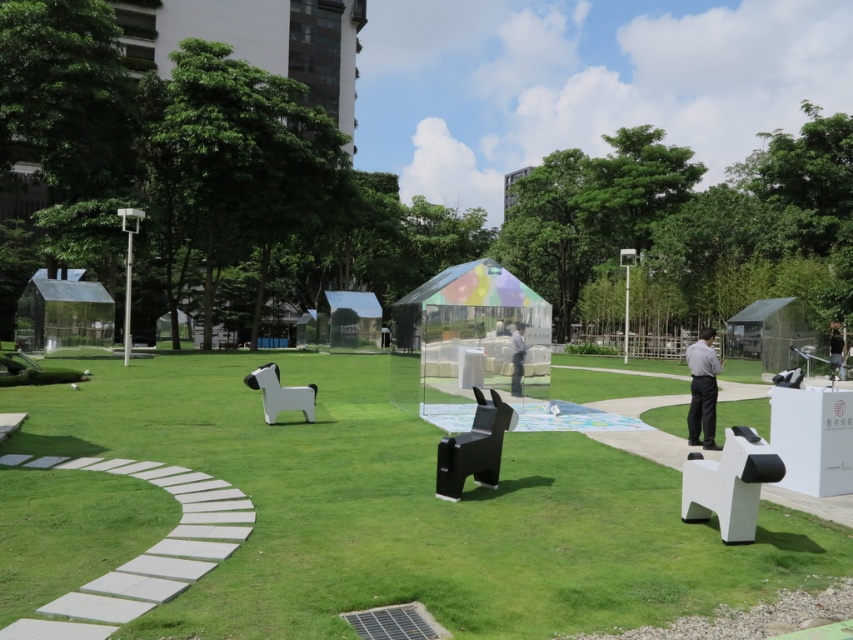
Question: Is white matte dog at center wider than light gray fabric shirt at right?

Choices:
 (A) no
 (B) yes

Answer: (B)

Question: Can you confirm if white matte dog at center is positioned to the left of smooth gray shirt at right?

Choices:
 (A) no
 (B) yes

Answer: (B)

Question: Which object appears farthest from the camera in this image?

Choices:
 (A) white matte dog at center
 (B) smooth gray shirt at right
 (C) gray fabric person at center
 (D) light gray fabric shirt at right

Answer: (B)

Question: Observing the image, what is the correct spatial positioning of black plastic dog at center in reference to gray fabric person at center?

Choices:
 (A) left
 (B) right

Answer: (A)

Question: Which point is closer to the camera?

Choices:
 (A) (514, 339)
 (B) (834, 336)

Answer: (A)

Question: Considering the real-world distances, which object is farthest from the light gray fabric shirt at right?

Choices:
 (A) white matte dog at center
 (B) black plastic dog at center

Answer: (A)